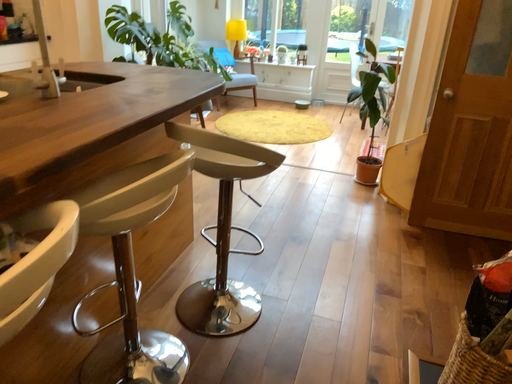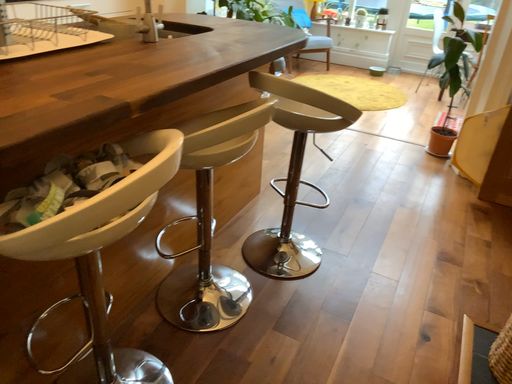
Question: How did the camera likely rotate when shooting the video?

Choices:
 (A) rotated left
 (B) rotated right

Answer: (A)